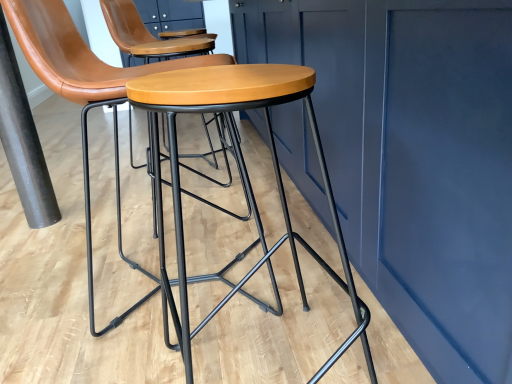
Question: From the image's perspective, is wooden/matte stool at center under matte black stool at center?

Choices:
 (A) yes
 (B) no

Answer: (A)

Question: Considering the relative positions of wooden/matte stool at center and matte black stool at center in the image provided, is wooden/matte stool at center behind matte black stool at center?

Choices:
 (A) yes
 (B) no

Answer: (B)

Question: From a real-world perspective, is wooden/matte stool at center physically below matte black stool at center?

Choices:
 (A) no
 (B) yes

Answer: (B)

Question: From a real-world perspective, is wooden/matte stool at center physically above matte black stool at center?

Choices:
 (A) no
 (B) yes

Answer: (A)

Question: Could you tell me if wooden/matte stool at center is turned towards matte black stool at center?

Choices:
 (A) yes
 (B) no

Answer: (B)

Question: Relative to matte black stool at center, is black matte pole at left in front or behind?

Choices:
 (A) behind
 (B) front

Answer: (A)

Question: Considering the positions of black matte pole at left and matte black stool at center in the image, is black matte pole at left taller or shorter than matte black stool at center?

Choices:
 (A) tall
 (B) short

Answer: (B)

Question: Based on their sizes in the image, would you say black matte pole at left is bigger or smaller than matte black stool at center?

Choices:
 (A) small
 (B) big

Answer: (A)

Question: Is point (7, 41) positioned closer to the camera than point (154, 66)?

Choices:
 (A) farther
 (B) closer

Answer: (A)

Question: Would you say matte black stool at center is inside or outside wooden/matte stool at center?

Choices:
 (A) inside
 (B) outside

Answer: (B)

Question: Is matte black stool at center taller or shorter than wooden/matte stool at center?

Choices:
 (A) tall
 (B) short

Answer: (A)

Question: Does point (26, 29) appear closer or farther from the camera than point (226, 82)?

Choices:
 (A) closer
 (B) farther

Answer: (B)

Question: From a real-world perspective, is matte black stool at center positioned above or below wooden/matte stool at center?

Choices:
 (A) below
 (B) above

Answer: (B)

Question: From their relative heights in the image, would you say matte black stool at center is taller or shorter than black matte pole at left?

Choices:
 (A) tall
 (B) short

Answer: (A)

Question: In terms of width, does matte black stool at center look wider or thinner when compared to black matte pole at left?

Choices:
 (A) wide
 (B) thin

Answer: (A)